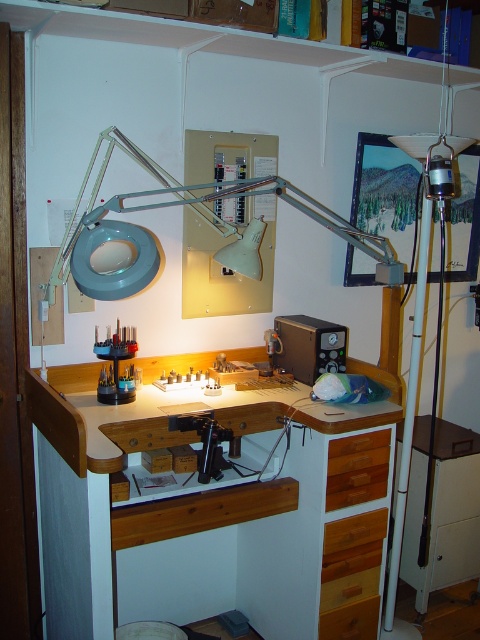
You are taking a photo of the workspace and want to ensure both point (343, 518) and point (128, 394) are clearly visible. Which point is closer to the camera?

Point (128, 394) is closer to the camera than point (343, 518).

Looking at this image, you are a worker needing to place a 18 inch ruler between the wooden at center and the matte plastic tool holder at center. Can you fit it there?

The distance between the wooden at center and the matte plastic tool holder at center is 17.96 inches, so the 18 inch ruler cannot fit in that space.